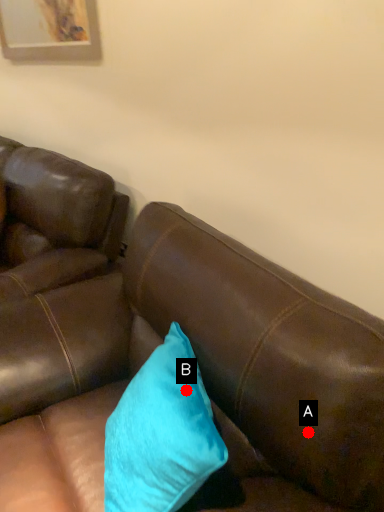
Question: Two points are circled on the image, labeled by A and B beside each circle. Which point is farther from the camera taking this photo?

Choices:
 (A) A is further
 (B) B is further

Answer: (B)